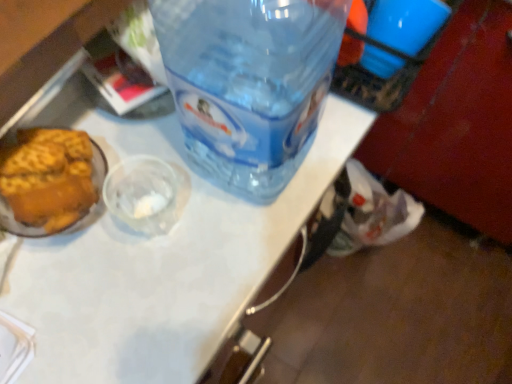
Where is `transparent plastic table at center`? transparent plastic table at center is located at coordinates (160, 259).

The width and height of the screenshot is (512, 384). Describe the element at coordinates (160, 259) in the screenshot. I see `transparent plastic table at center` at that location.

This screenshot has width=512, height=384. What are the coordinates of `transparent plastic bottle at center` in the screenshot? It's located at (249, 82).

What do you see at coordinates (249, 82) in the screenshot?
I see `transparent plastic bottle at center` at bounding box center [249, 82].

Where is `transparent plastic table at center`? transparent plastic table at center is located at coordinates (160, 259).

Consider the image. Is transparent plastic bottle at center at the left side of transparent plastic table at center?

Yes.

Which object is closer to the camera, transparent plastic bottle at center or transparent plastic table at center?

transparent plastic table at center is in front.

Is point (302, 83) in front of point (340, 133)?

That is True.

From the image's perspective, is transparent plastic bottle at center located above or below transparent plastic table at center?

transparent plastic bottle at center is above transparent plastic table at center.

From a real-world perspective, who is located higher, transparent plastic bottle at center or transparent plastic table at center?

transparent plastic bottle at center, from a real-world perspective.

Between transparent plastic bottle at center and transparent plastic table at center, which one has smaller width?

With smaller width is transparent plastic bottle at center.

Consider the image. Considering the sizes of objects transparent plastic bottle at center and transparent plastic table at center in the image provided, who is taller, transparent plastic bottle at center or transparent plastic table at center?

Standing taller between the two is transparent plastic table at center.

Is transparent plastic bottle at center smaller than transparent plastic table at center?

Yes.

Is transparent plastic table at center located within transparent plastic bottle at center?

No, transparent plastic bottle at center does not contain transparent plastic table at center.

From the picture: Is transparent plastic bottle at center far from transparent plastic table at center?

No, transparent plastic bottle at center is in close proximity to transparent plastic table at center.

Is transparent plastic bottle at center oriented away from transparent plastic table at center?

No, transparent plastic table at center is not at the back of transparent plastic bottle at center.

How far apart are transparent plastic bottle at center and transparent plastic table at center?

The distance of transparent plastic bottle at center from transparent plastic table at center is 4.58 inches.

Locate an element on the screen. bottle that is on the left side of transparent plastic table at center is located at coordinates (249, 82).

Is transparent plastic table at center to the left or to the right of transparent plastic bottle at center in the image?

In the image, transparent plastic table at center appears on the right side of transparent plastic bottle at center.

Is transparent plastic table at center further to camera compared to transparent plastic bottle at center?

That is False.

Which is behind, point (218, 211) or point (188, 105)?

The point (218, 211) is behind.

In the scene shown: From the image's perspective, is transparent plastic table at center above transparent plastic bottle at center?

Incorrect, from the image's perspective, transparent plastic table at center is lower than transparent plastic bottle at center.

From a real-world perspective, which object rests below the other?

transparent plastic table at center, from a real-world perspective.

Looking at their sizes, would you say transparent plastic table at center is wider or thinner than transparent plastic bottle at center?

Considering their sizes, transparent plastic table at center looks broader than transparent plastic bottle at center.

Considering the sizes of objects transparent plastic table at center and transparent plastic bottle at center in the image provided, who is shorter, transparent plastic table at center or transparent plastic bottle at center?

transparent plastic bottle at center.

From the picture: Can you confirm if transparent plastic table at center is smaller than transparent plastic bottle at center?

No, transparent plastic table at center is not smaller than transparent plastic bottle at center.

Is transparent plastic bottle at center located within transparent plastic table at center?

That's incorrect, transparent plastic bottle at center is not inside transparent plastic table at center.

Is transparent plastic table at center with transparent plastic bottle at center?

No.

Is transparent plastic table at center looking in the opposite direction of transparent plastic bottle at center?

No, transparent plastic table at center's orientation is not away from transparent plastic bottle at center.

How many degrees apart are the facing directions of transparent plastic table at center and transparent plastic bottle at center?

There is a 89.6-degree angle between the facing directions of transparent plastic table at center and transparent plastic bottle at center.

This screenshot has height=384, width=512. I want to click on table top directly beneath the transparent plastic bottle at center (from a real-world perspective), so click(x=160, y=259).

Where is `table top that is in front of the transparent plastic bottle at center`? This screenshot has width=512, height=384. table top that is in front of the transparent plastic bottle at center is located at coordinates (160, 259).

Locate an element on the screen. Image resolution: width=512 pixels, height=384 pixels. bottle behind the transparent plastic table at center is located at coordinates (249, 82).